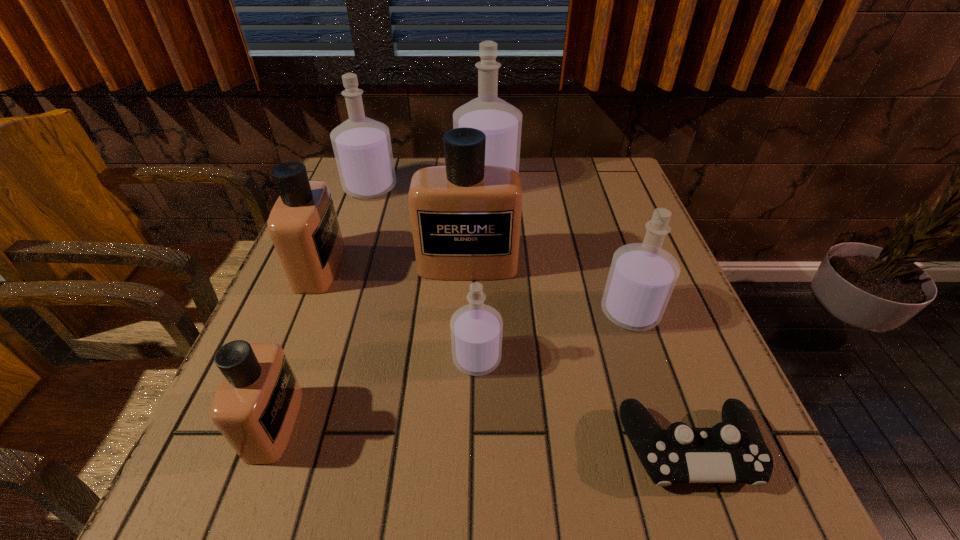
What are the coordinates of `perfume that is at the near edge` in the screenshot? It's located at (255, 408).

Locate an element on the screen. The image size is (960, 540). control at the near edge is located at coordinates (733, 451).

This screenshot has height=540, width=960. Find the location of `perfume at the right edge`. perfume at the right edge is located at coordinates (642, 276).

At what (x,y) coordinates should I click in order to perform the action: click on control that is positioned at the right edge. Please return your answer as a coordinate pair (x, y). The height and width of the screenshot is (540, 960). Looking at the image, I should click on (733, 451).

Locate an element on the screen. The height and width of the screenshot is (540, 960). object that is at the far left corner is located at coordinates (362, 147).

Find the location of a particular element. The image size is (960, 540). object positioned at the near left corner is located at coordinates (255, 408).

You are a GUI agent. You are given a task and a screenshot of the screen. Output one action in this format:
    pyautogui.click(x=<x>, y=<y>)
    Task: Click on the object that is at the near right corner
    This screenshot has width=960, height=540.
    Given the screenshot: What is the action you would take?
    733,451

In the image, there is a desktop. Where is `vacant region at the far edge`? The width and height of the screenshot is (960, 540). vacant region at the far edge is located at coordinates (568, 169).

Image resolution: width=960 pixels, height=540 pixels. Identify the location of vacant region at the near edge of the desktop. (600, 474).

Image resolution: width=960 pixels, height=540 pixels. I want to click on free space at the left edge, so click(x=287, y=353).